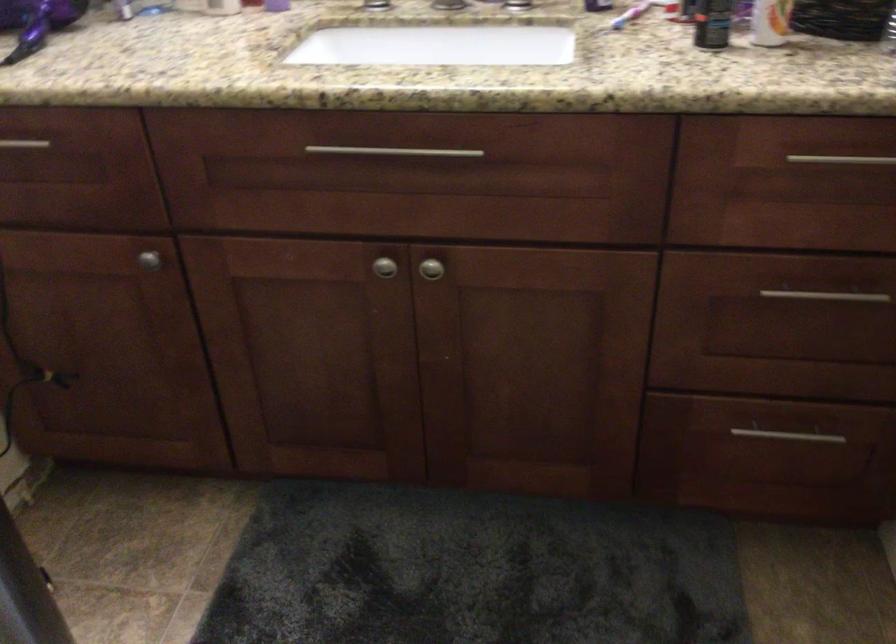
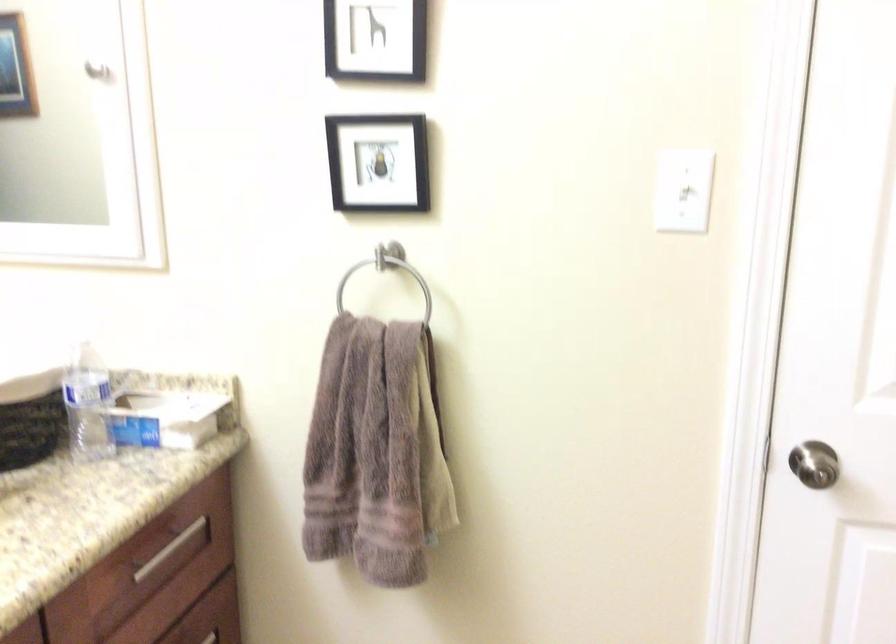
Question: How did the camera likely rotate?

Choices:
 (A) Left
 (B) Right
 (C) Up
 (D) Down

Answer: (B)